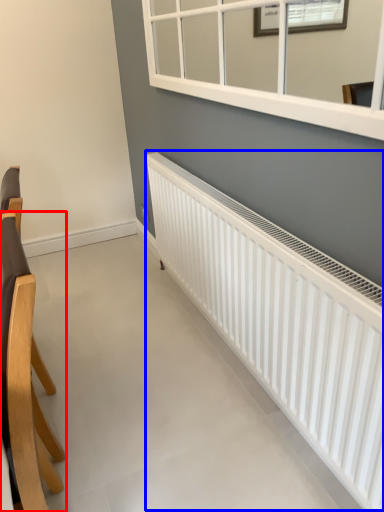
Question: Which point is closer to the camera, chair (highlighted by a red box) or radiator (highlighted by a blue box)?

Choices:
 (A) chair
 (B) radiator

Answer: (A)